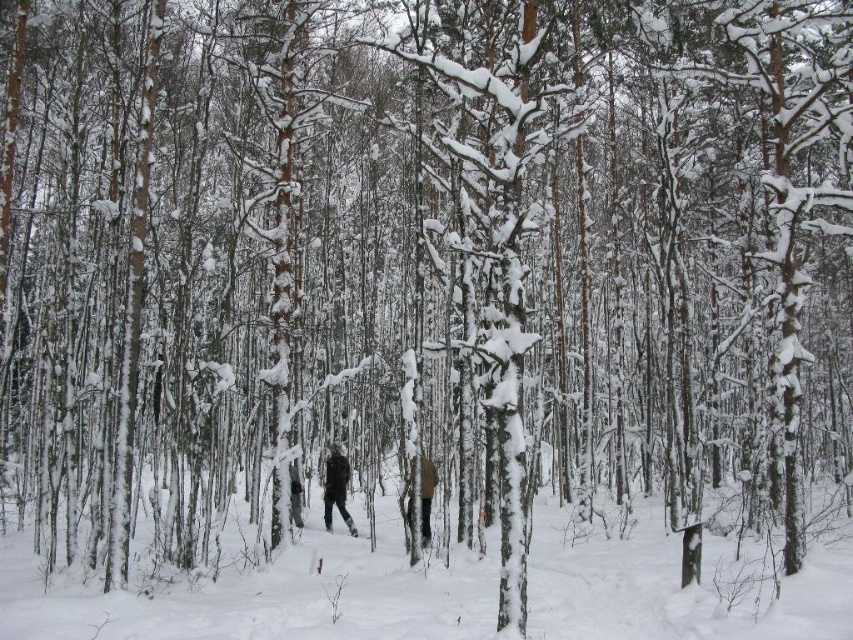
Where is `dark gray ski suit at center`? This screenshot has height=640, width=853. dark gray ski suit at center is located at coordinates (335, 486).

Which is in front, point (346, 522) or point (427, 518)?

Positioned in front is point (427, 518).

The height and width of the screenshot is (640, 853). I want to click on dark gray ski suit at center, so click(335, 486).

This screenshot has width=853, height=640. I want to click on dark gray ski suit at center, so click(335, 486).

Who is higher up, white powdery snow at center or brown woolen jacket at center?

brown woolen jacket at center is above.

Between white powdery snow at center and brown woolen jacket at center, which one appears on the left side from the viewer's perspective?

brown woolen jacket at center is more to the left.

Is point (662, 544) positioned in front of point (422, 499)?

No, it is behind (422, 499).

This screenshot has height=640, width=853. In order to click on white powdery snow at center in this screenshot , I will do `click(265, 596)`.

Is white powdery snow at center positioned at the back of dark gray ski suit at center?

No, white powdery snow at center is closer to the viewer.

Can you confirm if white powdery snow at center is wider than dark gray ski suit at center?

Indeed, white powdery snow at center has a greater width compared to dark gray ski suit at center.

Between point (216, 600) and point (347, 522), which one is positioned behind?

The point (347, 522) is behind.

Locate an element on the screen. white powdery snow at center is located at coordinates (265, 596).